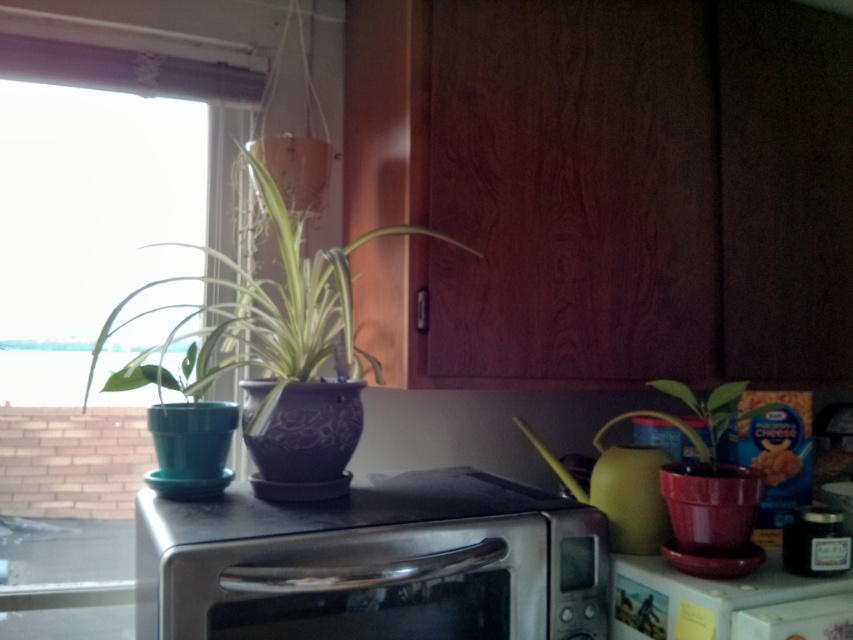
Question: Is satin silver microwave at center thinner than transparent glass door at left?

Choices:
 (A) no
 (B) yes

Answer: (A)

Question: Which of these objects is positioned farthest from the green matte plant at center?

Choices:
 (A) satin silver microwave at center
 (B) transparent glass door at left
 (C) matte purple pot at left

Answer: (B)

Question: Is transparent glass door at left positioned in front of matte purple pot at left?

Choices:
 (A) yes
 (B) no

Answer: (B)

Question: Which of the following is the farthest from the observer?

Choices:
 (A) (724, 408)
 (B) (325, 262)
 (C) (125, 490)
 (D) (408, 472)

Answer: (C)

Question: Is satin silver microwave at center wider than matte purple pot at left?

Choices:
 (A) no
 (B) yes

Answer: (B)

Question: Which point is closer to the camera?

Choices:
 (A) satin silver microwave at center
 (B) matte purple pot at left
 (C) transparent glass door at left
 (D) green matte plant at center

Answer: (A)